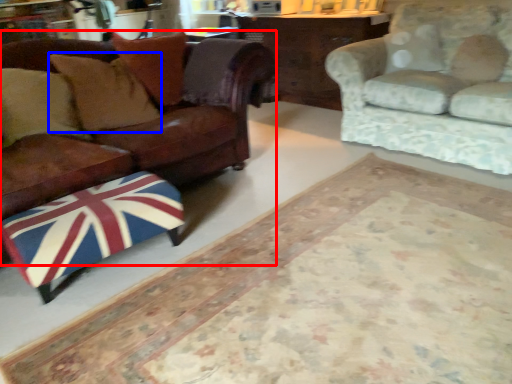
Question: Which object is further to the camera taking this photo, studio couch (highlighted by a red box) or pillow (highlighted by a blue box)?

Choices:
 (A) studio couch
 (B) pillow

Answer: (B)